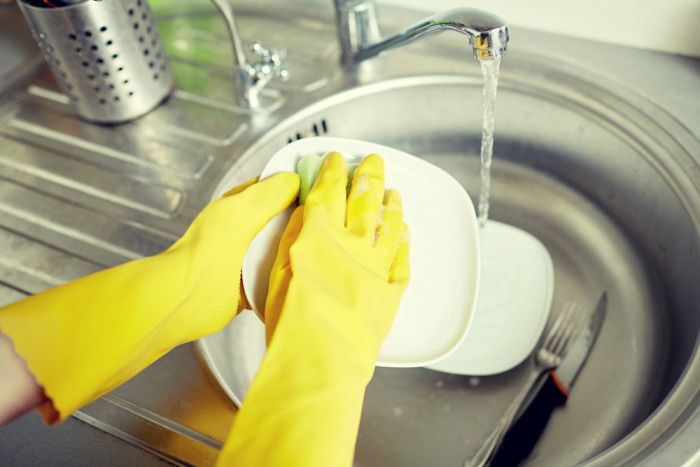
What are the coordinates of `sponge` in the screenshot? It's located at pyautogui.click(x=308, y=168).